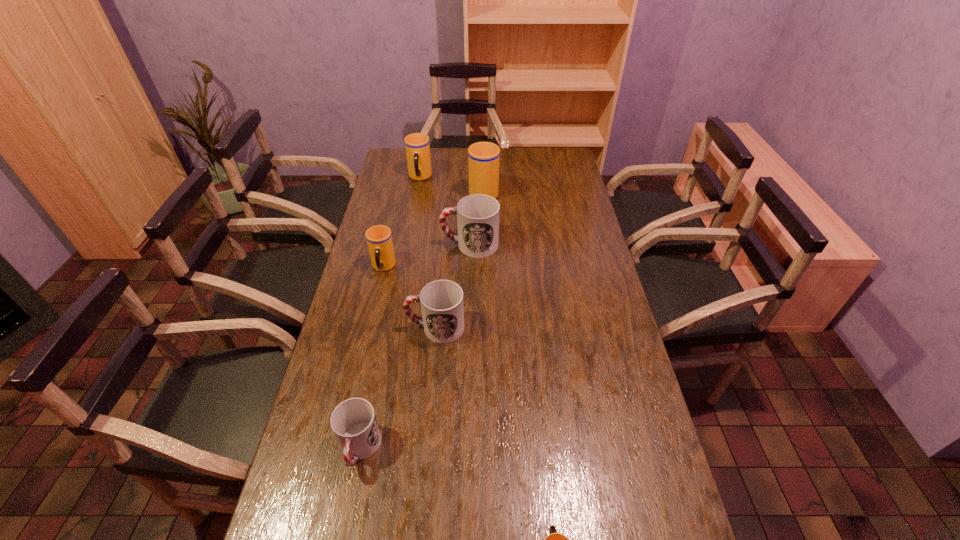
Locate which object ranks fourth in proximity to the second biggest beige cup. Please provide its 2D coordinates. Your answer should be formatted as a tuple, i.e. [(x, y)], where the tuple contains the x and y coordinates of a point satisfying the conditions above.

[(442, 307)]

The image size is (960, 540). Identify the location of object that is the fifth closest to the sixth farthest cup. (483, 157).

Point out which cup is positioned as the third nearest to the tallest cup. Please provide its 2D coordinates. Your answer should be formatted as a tuple, i.e. [(x, y)], where the tuple contains the x and y coordinates of a point satisfying the conditions above.

[(379, 239)]

Point out which cup is positioned as the sixth nearest to the smallest beige cup. Please provide its 2D coordinates. Your answer should be formatted as a tuple, i.e. [(x, y)], where the tuple contains the x and y coordinates of a point satisfying the conditions above.

[(417, 146)]

Identify which beige cup is the nearest to the second smallest beige cup. Please provide its 2D coordinates. Your answer should be formatted as a tuple, i.e. [(x, y)], where the tuple contains the x and y coordinates of a point satisfying the conditions above.

[(483, 157)]

Identify which beige cup is the third closest to the second biggest beige cup. Please provide its 2D coordinates. Your answer should be formatted as a tuple, i.e. [(x, y)], where the tuple contains the x and y coordinates of a point satisfying the conditions above.

[(554, 539)]

Where is `red cup that is the closest to the rightmost cup`? red cup that is the closest to the rightmost cup is located at coordinates (354, 423).

Locate which red cup is the second closest to the sixth farthest cup. Please provide its 2D coordinates. Your answer should be formatted as a tuple, i.e. [(x, y)], where the tuple contains the x and y coordinates of a point satisfying the conditions above.

[(477, 215)]

Locate an element on the screen. The image size is (960, 540). vacant position in the image that satisfies the following two spatial constraints: 1. on the side of the third smallest beige cup with the handle; 2. on the handle side of the third nearest object is located at coordinates (393, 327).

Where is `vacant space that satisfies the following two spatial constraints: 1. on the handle side of the third nearest object; 2. on the side of the second biggest beige cup with the handle`? The image size is (960, 540). vacant space that satisfies the following two spatial constraints: 1. on the handle side of the third nearest object; 2. on the side of the second biggest beige cup with the handle is located at coordinates (449, 178).